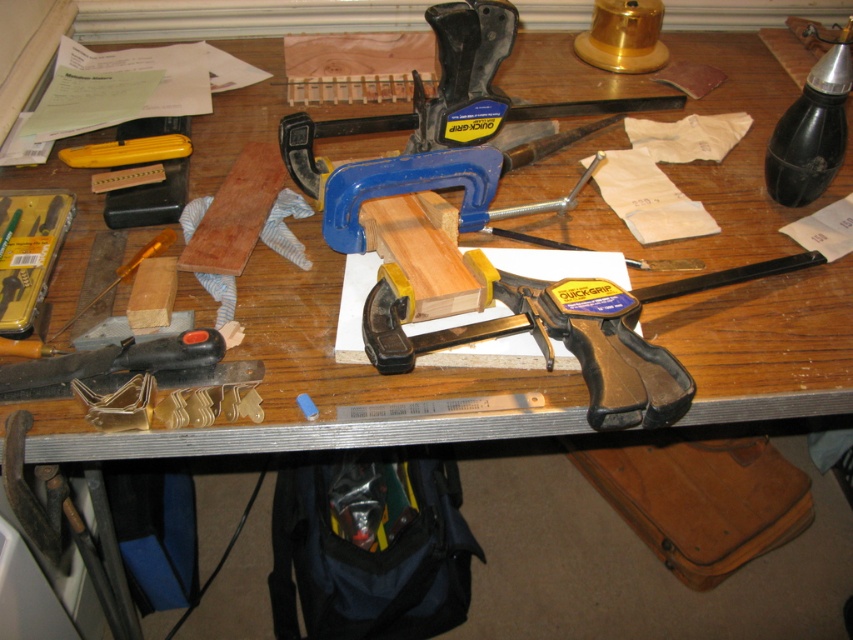
Question: Which object is the closest to the wooden at center?

Choices:
 (A) wooden plank at center
 (B) satin chrome screwdriver at lower left
 (C) yellow plastic ruler at upper left
 (D) black plastic utility knife at lower left

Answer: (A)

Question: Which object is the farthest from the matte plastic clamp at center?

Choices:
 (A) wooden plank at center
 (B) satin chrome screwdriver at lower left

Answer: (B)

Question: Estimate the real-world distances between objects in this image. Which object is farther from the black plastic utility knife at lower left?

Choices:
 (A) wooden plank at center
 (B) wooden at center
 (C) satin chrome screwdriver at lower left
 (D) yellow plastic ruler at upper left

Answer: (D)

Question: Does yellow plastic ruler at upper left have a larger size compared to satin chrome screwdriver at lower left?

Choices:
 (A) no
 (B) yes

Answer: (A)

Question: Can you confirm if wooden at center is bigger than wooden plank at center?

Choices:
 (A) yes
 (B) no

Answer: (A)

Question: Is wooden plank at center wider than satin chrome screwdriver at lower left?

Choices:
 (A) yes
 (B) no

Answer: (B)